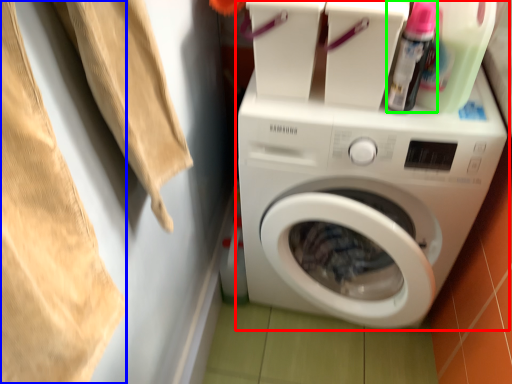
Question: Which is farther away from washing machine (highlighted by a red box)? clothing (highlighted by a blue box) or cleaning product (highlighted by a green box)?

Choices:
 (A) clothing
 (B) cleaning product

Answer: (A)